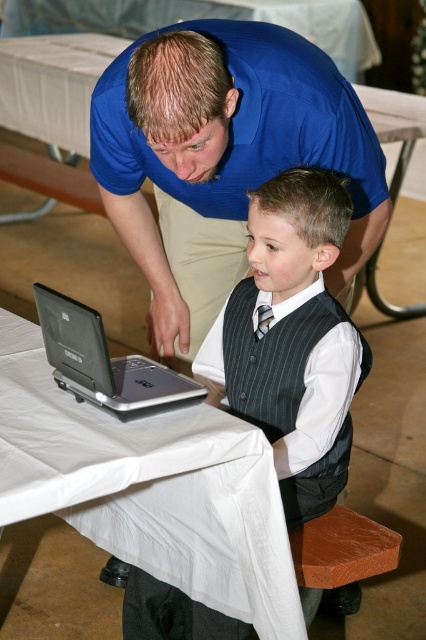
Question: Does white cloth-covered table at center come behind silver metallic laptop at center?

Choices:
 (A) no
 (B) yes

Answer: (A)

Question: Among these objects, which one is nearest to the camera?

Choices:
 (A) white cloth-covered table at center
 (B) blue smooth shirt at upper center

Answer: (A)

Question: Based on their relative distances, which object is nearer to the silver metallic laptop at center?

Choices:
 (A) pinstriped vest at center
 (B) blue smooth shirt at upper center
 (C) white cloth-covered table at center

Answer: (C)

Question: Can you confirm if silver metallic laptop at center is wider than black pinstripe tie at center?

Choices:
 (A) no
 (B) yes

Answer: (B)

Question: Can you confirm if pinstriped vest at center is wider than black pinstripe tie at center?

Choices:
 (A) no
 (B) yes

Answer: (B)

Question: Which of the following is the farthest from the observer?

Choices:
 (A) silver metallic laptop at center
 (B) pinstriped vest at center
 (C) black pinstripe tie at center

Answer: (C)